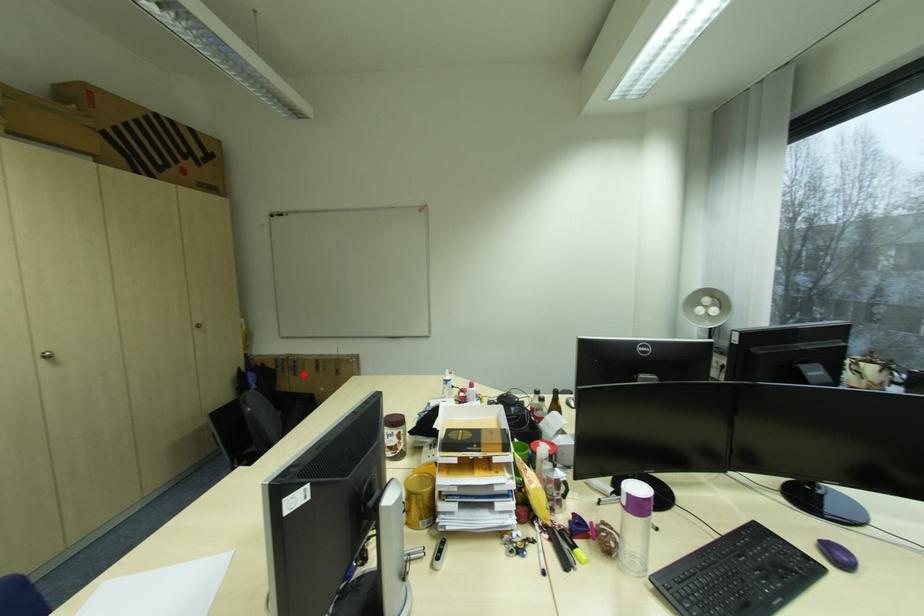
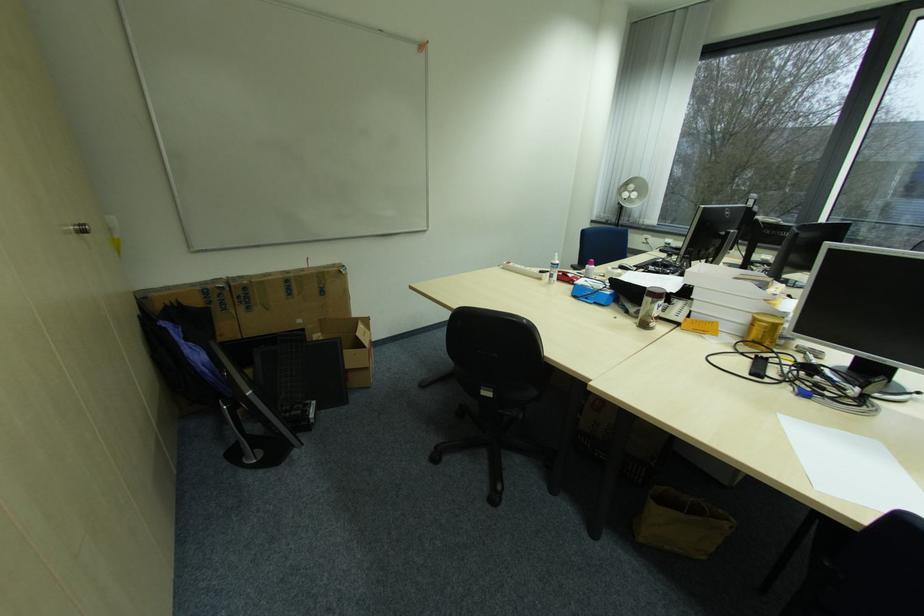
The point at the highlighted location is marked in the first image. Where is the corresponding point in the second image?

(257, 309)